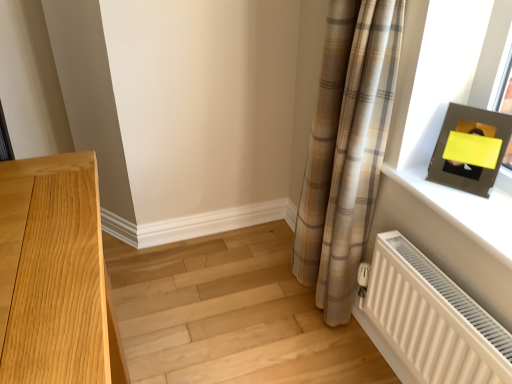
Question: Is light wood floor at lower left behind matte black picture frame at upper right?

Choices:
 (A) no
 (B) yes

Answer: (B)

Question: Does light wood floor at lower left come in front of matte black picture frame at upper right?

Choices:
 (A) yes
 (B) no

Answer: (B)

Question: Can you confirm if light wood floor at lower left is smaller than matte black picture frame at upper right?

Choices:
 (A) no
 (B) yes

Answer: (A)

Question: From the image's perspective, is light wood floor at lower left on matte black picture frame at upper right?

Choices:
 (A) yes
 (B) no

Answer: (B)

Question: Can you confirm if light wood floor at lower left is taller than matte black picture frame at upper right?

Choices:
 (A) yes
 (B) no

Answer: (B)

Question: Considering the positions of light wood floor at lower left and white ribbed radiator at lower right in the image, is light wood floor at lower left bigger or smaller than white ribbed radiator at lower right?

Choices:
 (A) small
 (B) big

Answer: (B)

Question: Is light wood floor at lower left inside or outside of white ribbed radiator at lower right?

Choices:
 (A) inside
 (B) outside

Answer: (B)

Question: Based on their positions, is light wood floor at lower left located to the left or right of white ribbed radiator at lower right?

Choices:
 (A) left
 (B) right

Answer: (A)

Question: In terms of height, does light wood floor at lower left look taller or shorter compared to white ribbed radiator at lower right?

Choices:
 (A) tall
 (B) short

Answer: (B)

Question: In the image, is white ribbed radiator at lower right positioned in front of or behind plaid fabric curtain at right?

Choices:
 (A) front
 (B) behind

Answer: (A)

Question: Does point (412, 296) appear closer or farther from the camera than point (349, 193)?

Choices:
 (A) farther
 (B) closer

Answer: (B)

Question: Visually, is white ribbed radiator at lower right positioned to the left or to the right of plaid fabric curtain at right?

Choices:
 (A) right
 (B) left

Answer: (A)

Question: In terms of height, does white ribbed radiator at lower right look taller or shorter compared to plaid fabric curtain at right?

Choices:
 (A) tall
 (B) short

Answer: (B)

Question: Is matte black frame at upper right wider or thinner than light wood floor at lower left?

Choices:
 (A) wide
 (B) thin

Answer: (B)

Question: From the image's perspective, is matte black frame at upper right above or below light wood floor at lower left?

Choices:
 (A) below
 (B) above

Answer: (B)